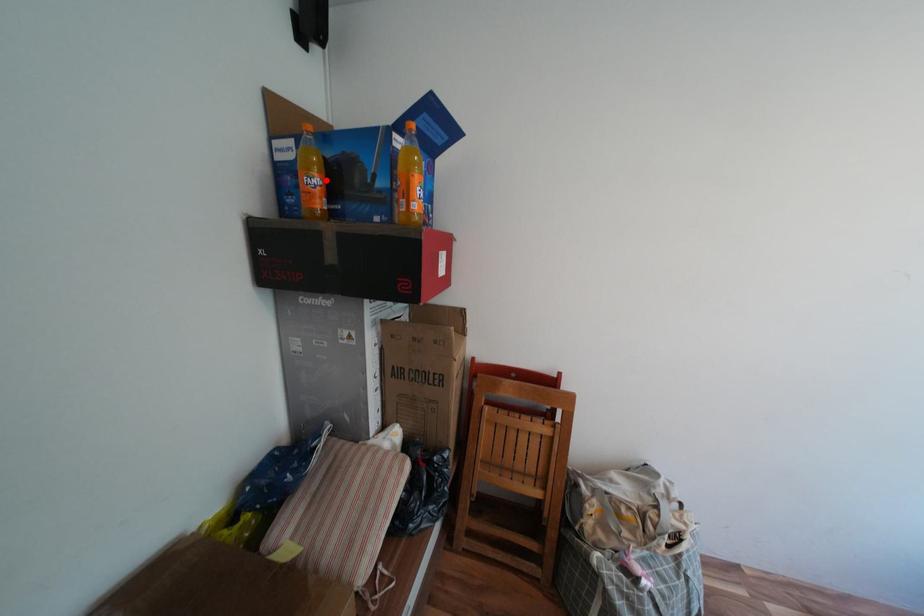
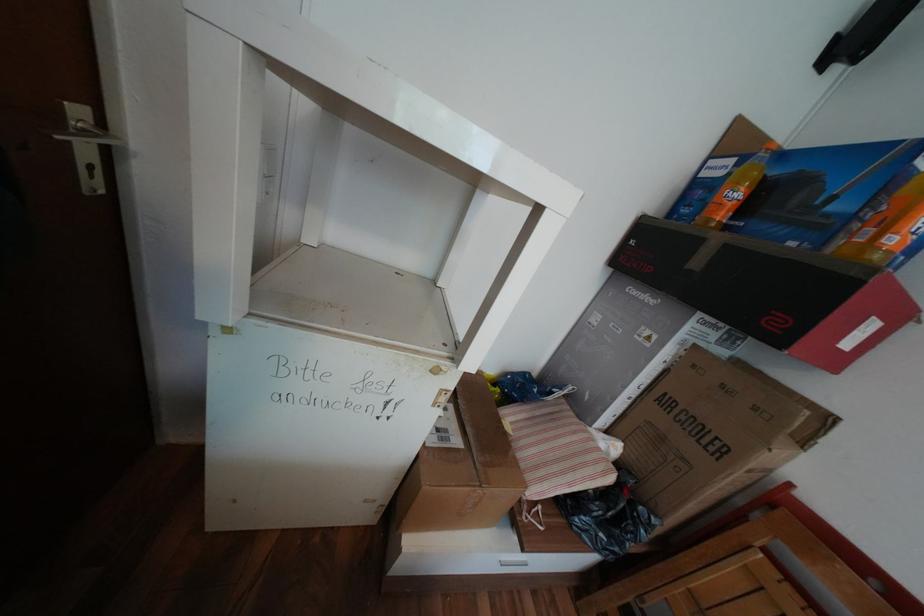
The point at the highlighted location is marked in the first image. Where is the corresponding point in the second image?

(748, 195)